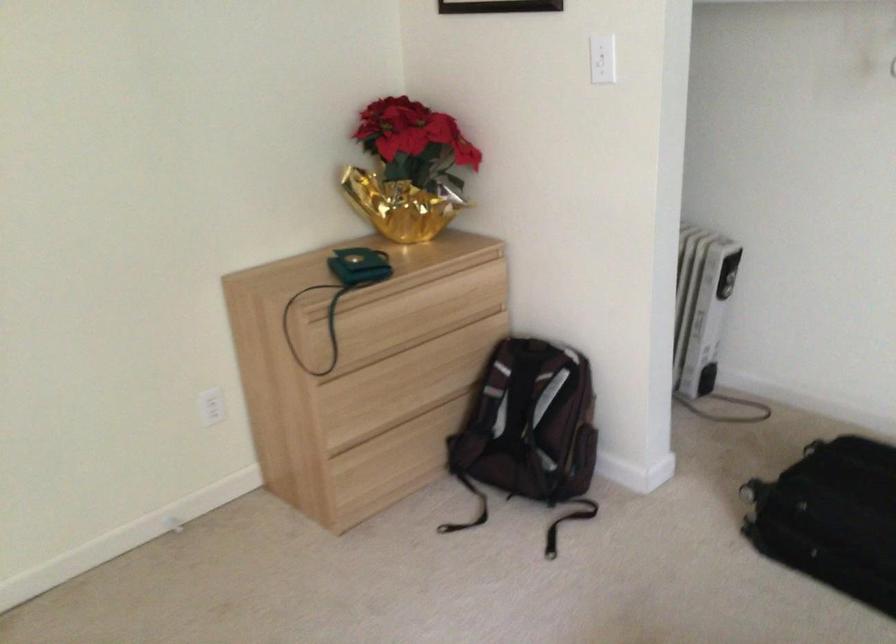
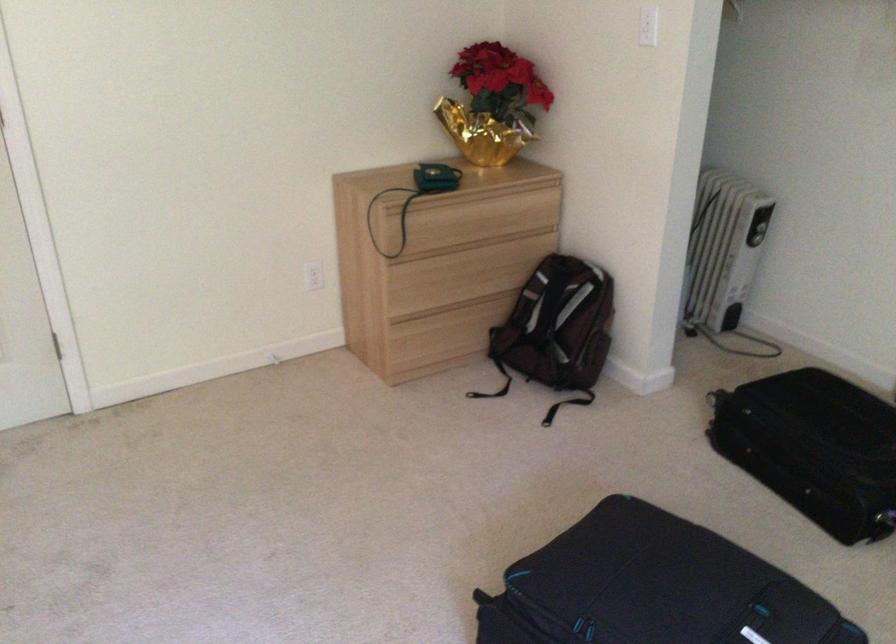
In the second image, find the point that corresponds to (435,298) in the first image.

(492, 210)